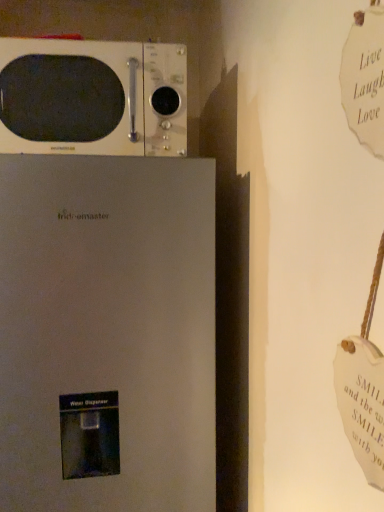
Question: Considering the relative sizes of satin white refrigerator at lower left and white glossy microwave at upper left in the image provided, is satin white refrigerator at lower left bigger than white glossy microwave at upper left?

Choices:
 (A) no
 (B) yes

Answer: (B)

Question: From a real-world perspective, is satin white refrigerator at lower left physically above white glossy microwave at upper left?

Choices:
 (A) yes
 (B) no

Answer: (B)

Question: Is satin white refrigerator at lower left aimed at white glossy microwave at upper left?

Choices:
 (A) no
 (B) yes

Answer: (A)

Question: Does satin white refrigerator at lower left appear on the right side of white glossy microwave at upper left?

Choices:
 (A) yes
 (B) no

Answer: (B)

Question: Does satin white refrigerator at lower left come in front of white glossy microwave at upper left?

Choices:
 (A) yes
 (B) no

Answer: (A)

Question: Is satin white refrigerator at lower left turned away from white glossy microwave at upper left?

Choices:
 (A) no
 (B) yes

Answer: (A)

Question: From the image's perspective, would you say white glossy microwave at upper left is shown under satin white refrigerator at lower left?

Choices:
 (A) yes
 (B) no

Answer: (B)

Question: Is white glossy microwave at upper left placed right next to satin white refrigerator at lower left?

Choices:
 (A) yes
 (B) no

Answer: (B)

Question: Is white glossy microwave at upper left to the left of satin white refrigerator at lower left from the viewer's perspective?

Choices:
 (A) yes
 (B) no

Answer: (B)

Question: Is white glossy microwave at upper left looking in the opposite direction of satin white refrigerator at lower left?

Choices:
 (A) no
 (B) yes

Answer: (A)

Question: Can you confirm if white glossy microwave at upper left is positioned to the right of satin white refrigerator at lower left?

Choices:
 (A) no
 (B) yes

Answer: (B)

Question: From a real-world perspective, is white glossy microwave at upper left on satin white refrigerator at lower left?

Choices:
 (A) no
 (B) yes

Answer: (B)

Question: Is point (178, 501) closer or farther from the camera than point (66, 41)?

Choices:
 (A) closer
 (B) farther

Answer: (B)